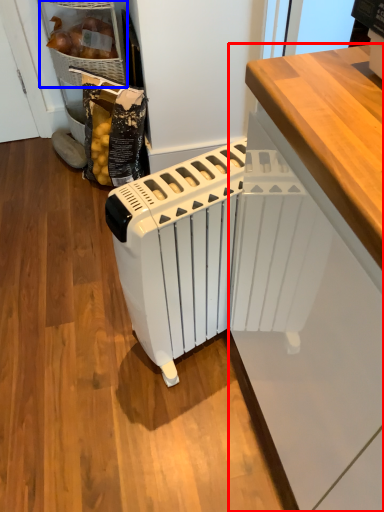
Question: Which object is further to the camera taking this photo, cabinetry (highlighted by a red box) or cabinetry (highlighted by a blue box)?

Choices:
 (A) cabinetry
 (B) cabinetry

Answer: (B)